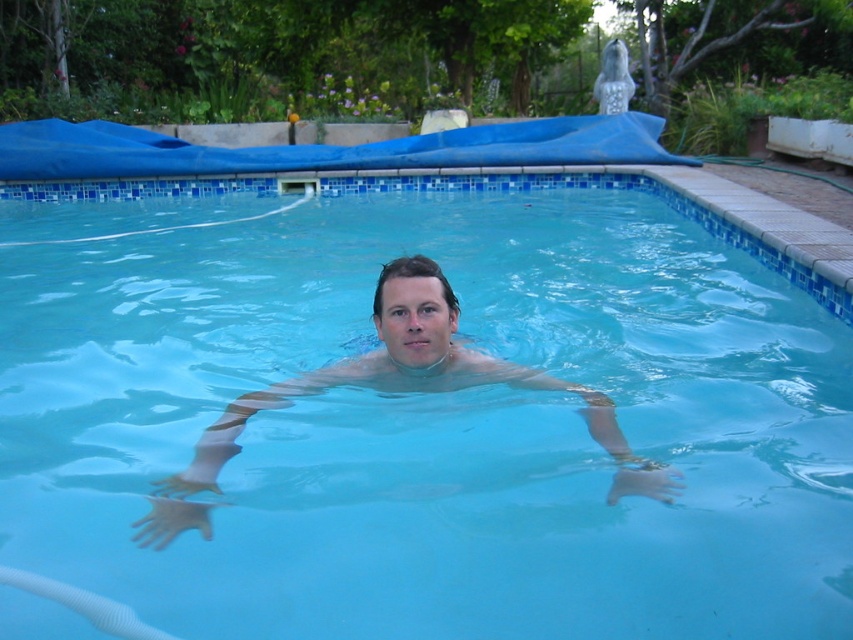
Describe the element at coordinates (438, 420) in the screenshot. The height and width of the screenshot is (640, 853). I see `transparent blue water at center` at that location.

This screenshot has height=640, width=853. Find the location of `transparent blue water at center`. transparent blue water at center is located at coordinates (438, 420).

Image resolution: width=853 pixels, height=640 pixels. In order to click on transparent blue water at center in this screenshot , I will do `click(438, 420)`.